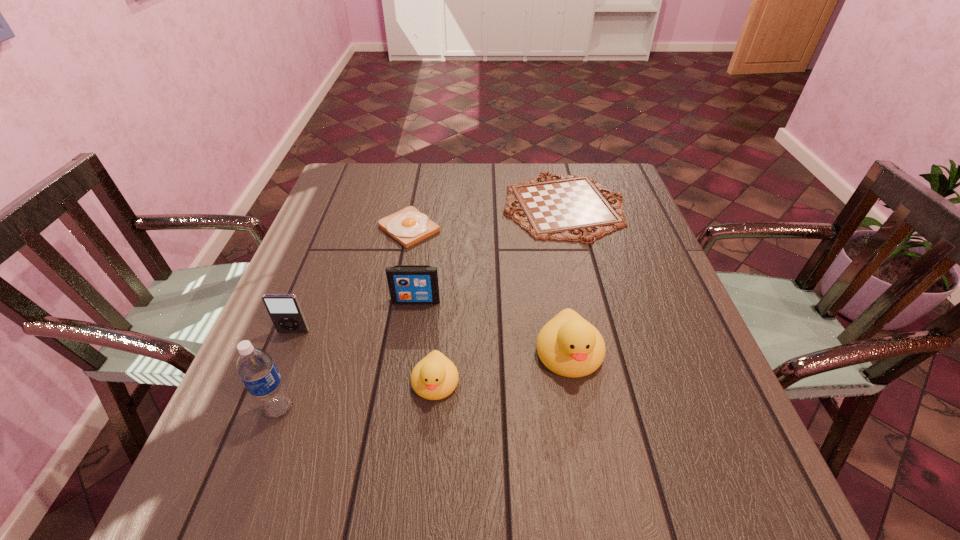
Please point a spot to add another duckling on the right. Please provide its 2D coordinates. Your answer should be formatted as a tuple, i.e. [(x, y)], where the tuple contains the x and y coordinates of a point satisfying the conditions above.

[(689, 328)]